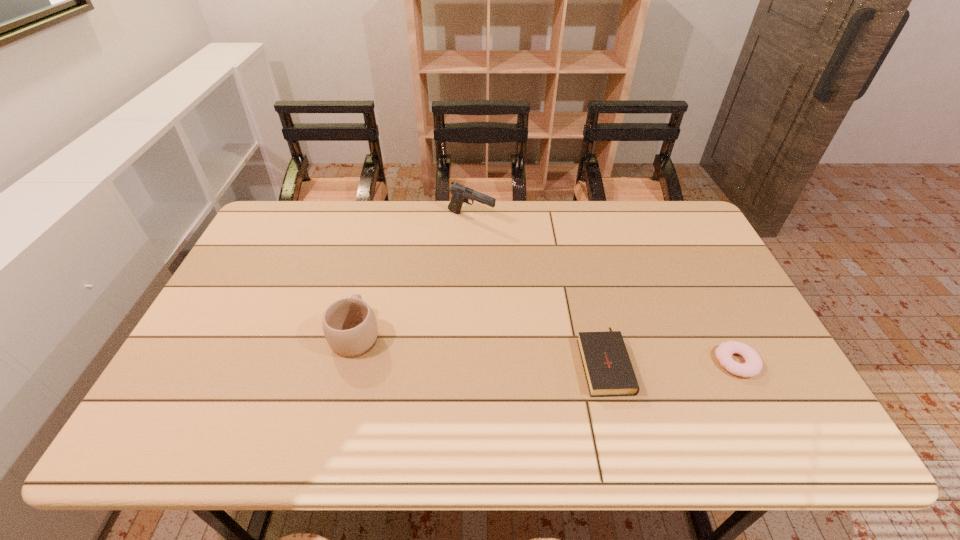
The width and height of the screenshot is (960, 540). I want to click on gun, so click(460, 194).

What are the coordinates of `the farthest object` in the screenshot? It's located at [460, 194].

This screenshot has height=540, width=960. I want to click on the leftmost object, so click(349, 324).

Identify the location of mug. Image resolution: width=960 pixels, height=540 pixels. (349, 324).

Find the location of a particular element. This screenshot has height=540, width=960. the second object from right to left is located at coordinates (608, 369).

I want to click on the third tallest object, so click(608, 369).

This screenshot has width=960, height=540. Find the location of `the rightmost object`. the rightmost object is located at coordinates (753, 364).

I want to click on doughnut, so click(x=753, y=364).

Identify the location of vacant area situated 0.320m at the muzzle of the tallest object. The image size is (960, 540). (586, 219).

This screenshot has width=960, height=540. I want to click on vacant point located 0.320m on the side of the leftmost object with the handle, so click(380, 238).